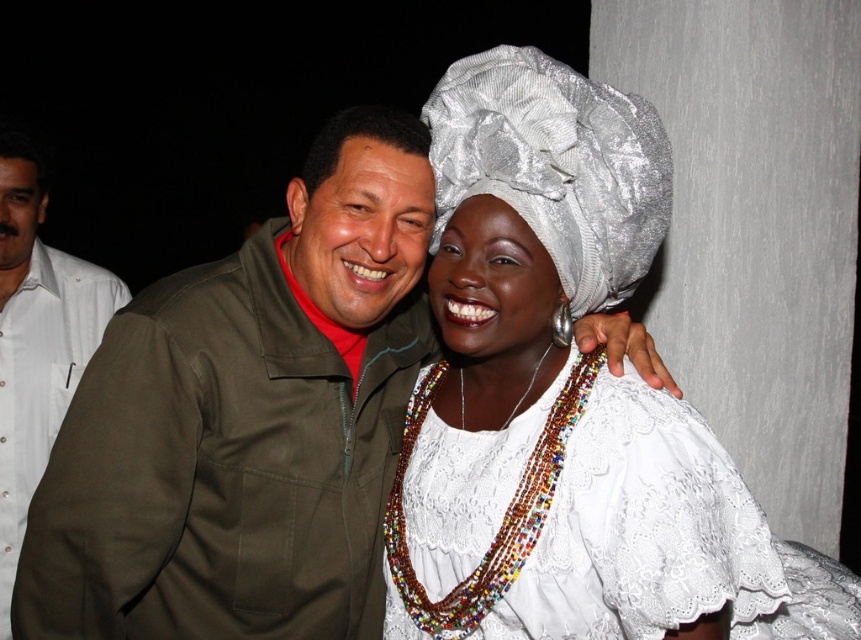
Can you confirm if multicolored beaded necklace at center is bigger than white matte head at left?

Indeed, multicolored beaded necklace at center has a larger size compared to white matte head at left.

Which is more to the left, multicolored beaded necklace at center or white matte head at left?

From the viewer's perspective, white matte head at left appears more on the left side.

Which is in front, point (577, 400) or point (36, 168)?

Point (577, 400) is in front.

Image resolution: width=861 pixels, height=640 pixels. What are the coordinates of `multicolored beaded necklace at center` in the screenshot? It's located at coord(502,516).

Does white shirt at left have a smaller size compared to olive-green fabric jacket at center?

No, white shirt at left is not smaller than olive-green fabric jacket at center.

The image size is (861, 640). I want to click on white shirt at left, so click(36, 340).

At what (x,y) coordinates should I click in order to perform the action: click on white shirt at left. Please return your answer as a coordinate pair (x, y). The height and width of the screenshot is (640, 861). Looking at the image, I should click on (36, 340).

Does white satin turban at upper center appear on the left side of white shirt at left?

No, white satin turban at upper center is not to the left of white shirt at left.

Which is below, white satin turban at upper center or white shirt at left?

Positioned lower is white shirt at left.

Locate an element on the screen. white satin turban at upper center is located at coordinates (554, 388).